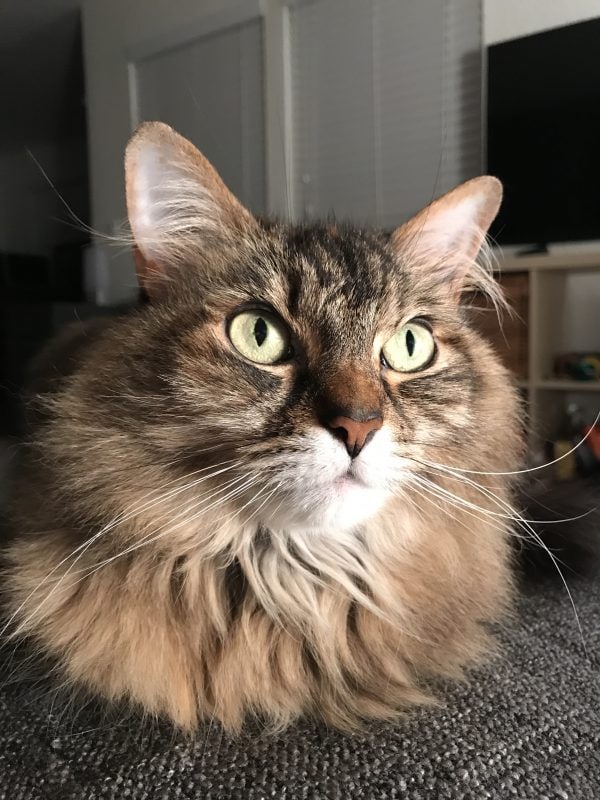
The width and height of the screenshot is (600, 800). I want to click on tv, so click(x=563, y=138).